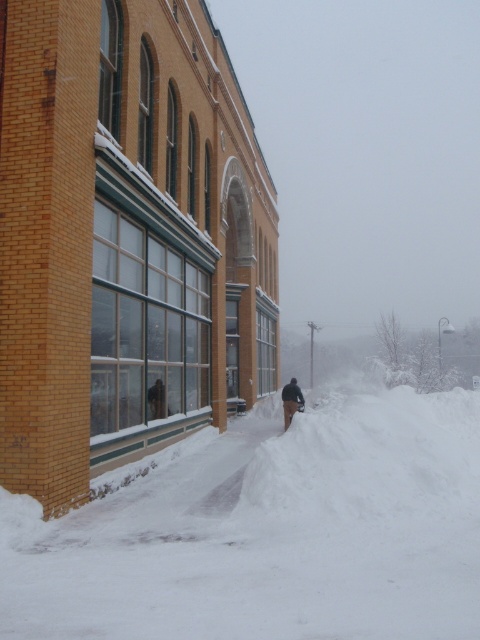
Is point (201, 464) positioned after point (288, 419)?

That is False.

Is the position of white fluffy snow at lower center less distant than that of dark brown fur coat at lower center?

Yes, it is.

What do you see at coordinates (271, 532) in the screenshot? I see `white fluffy snow at lower center` at bounding box center [271, 532].

Find the location of a particular element. white fluffy snow at lower center is located at coordinates (271, 532).